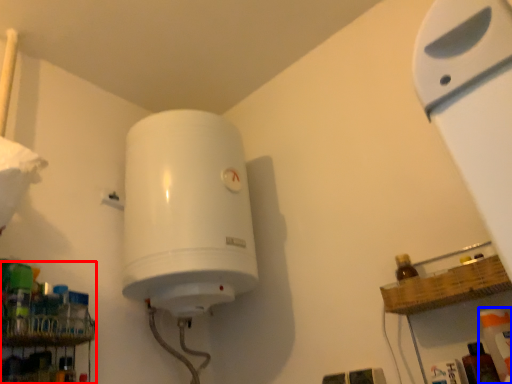
Question: Among these objects, which one is nearest to the camera, shelf (highlighted by a red box) or cleaning product (highlighted by a blue box)?

Choices:
 (A) shelf
 (B) cleaning product

Answer: (B)